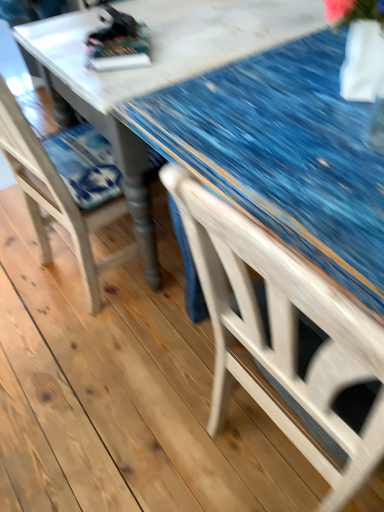
Question: Does point (125, 257) appear closer or farther from the camera than point (244, 159)?

Choices:
 (A) closer
 (B) farther

Answer: (B)

Question: Relative to blue fabric-covered table at center, is wooden chair at left in front or behind?

Choices:
 (A) behind
 (B) front

Answer: (B)

Question: Looking at their shapes, would you say wooden chair at left is wider or thinner than blue fabric-covered table at center?

Choices:
 (A) wide
 (B) thin

Answer: (B)

Question: From the image's perspective, relative to wooden chair at left, is blue fabric-covered table at center above or below?

Choices:
 (A) below
 (B) above

Answer: (B)

Question: In terms of width, does blue fabric-covered table at center look wider or thinner when compared to wooden chair at left?

Choices:
 (A) wide
 (B) thin

Answer: (A)

Question: Is blue fabric-covered table at center bigger or smaller than wooden chair at left?

Choices:
 (A) big
 (B) small

Answer: (A)

Question: Considering the positions of blue fabric-covered table at center and wooden chair at left in the image, is blue fabric-covered table at center taller or shorter than wooden chair at left?

Choices:
 (A) tall
 (B) short

Answer: (B)